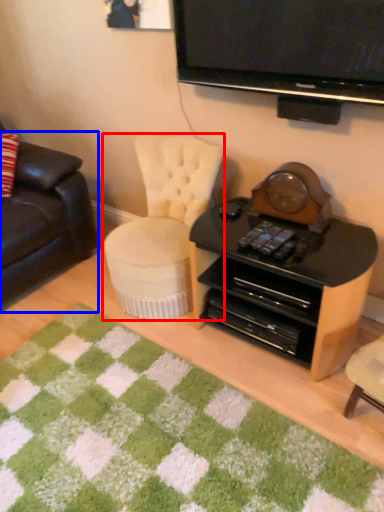
Question: Which object appears farthest to the camera in this image, chair (highlighted by a red box) or studio couch (highlighted by a blue box)?

Choices:
 (A) chair
 (B) studio couch

Answer: (B)